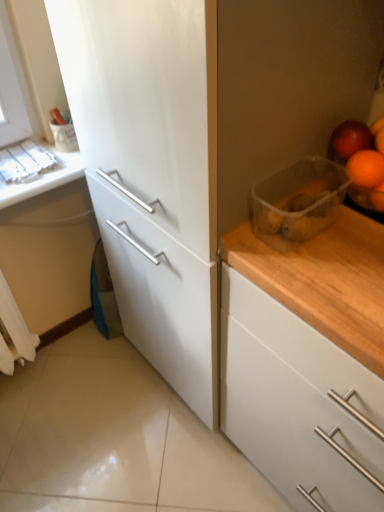
Question: From a real-world perspective, is white fabric curtain at lower left above or below orange matte plastic at upper right?

Choices:
 (A) above
 (B) below

Answer: (B)

Question: Is white fabric curtain at lower left situated inside orange matte plastic at upper right or outside?

Choices:
 (A) inside
 (B) outside

Answer: (B)

Question: Which object is the closest to the glossy red apple at upper right?

Choices:
 (A) white fabric curtain at lower left
 (B) wooden countertop at right
 (C) orange matte plastic at upper right
 (D) white matte counter top at upper left
 (E) transparent plastic container at upper right

Answer: (C)

Question: Which object is positioned closest to the white fabric curtain at lower left?

Choices:
 (A) wooden countertop at right
 (B) orange matte plastic at upper right
 (C) white matte counter top at upper left
 (D) transparent plastic container at upper right
 (E) glossy red apple at upper right

Answer: (C)